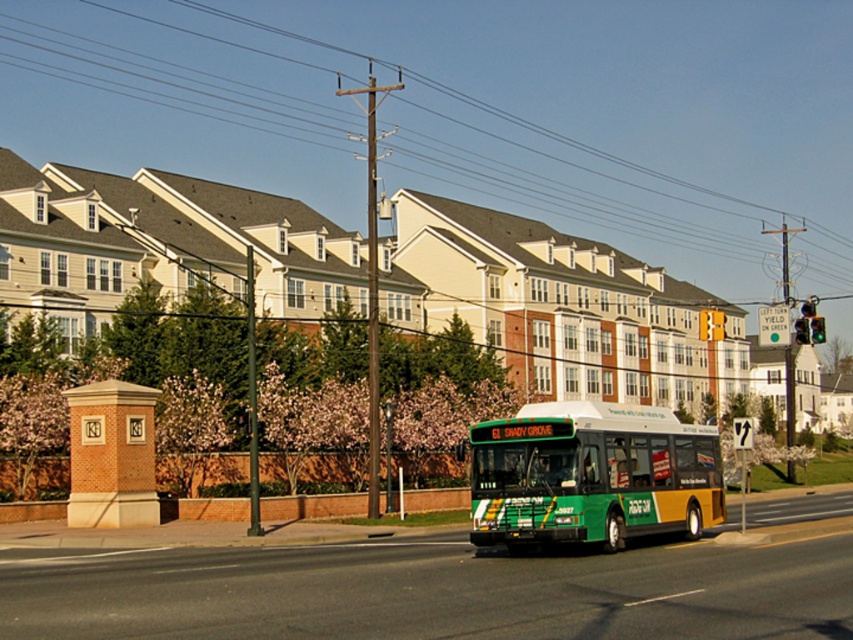
Is green glass traffic light at center shorter than green glass traffic light at center right?

In fact, green glass traffic light at center may be taller than green glass traffic light at center right.

Is green glass traffic light at center thinner than green glass traffic light at center right?

Incorrect, green glass traffic light at center's width is not less than green glass traffic light at center right's.

Is point (700, 317) farther from viewer compared to point (816, 321)?

Yes, point (700, 317) is farther from viewer.

Locate an element on the screen. Image resolution: width=853 pixels, height=640 pixels. green glass traffic light at center is located at coordinates pos(711,324).

Consider the image. Is green glass traffic light at center right to the left of metallic green traffic light at center right from the viewer's perspective?

No, green glass traffic light at center right is not to the left of metallic green traffic light at center right.

Is point (822, 317) positioned before point (805, 342)?

No, it is behind (805, 342).

You are a GUI agent. You are given a task and a screenshot of the screen. Output one action in this format:
    pyautogui.click(x=<x>, y=<y>)
    Task: Click on the green glass traffic light at center right
    The height and width of the screenshot is (640, 853).
    Given the screenshot: What is the action you would take?
    (x=816, y=330)

Does brown wooden power line at upper center have a larger size compared to green glass traffic light at center?

Yes.

Does brown wooden power line at upper center appear over green glass traffic light at center?

Indeed, brown wooden power line at upper center is positioned over green glass traffic light at center.

Where is `brown wooden power line at upper center`? This screenshot has width=853, height=640. brown wooden power line at upper center is located at coordinates (474, 113).